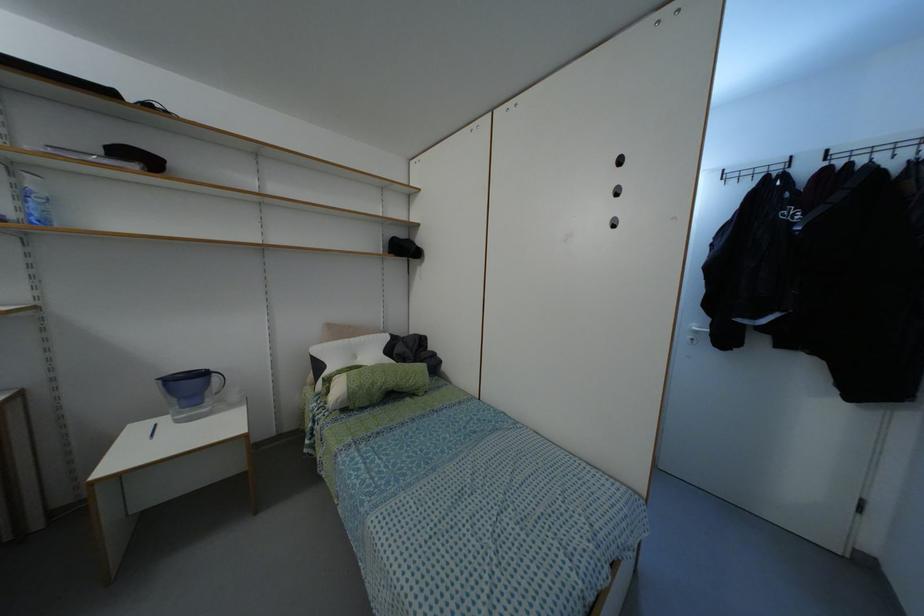
This screenshot has height=616, width=924. What are the coordinates of `green patterned pillow` in the screenshot? It's located at (375, 384).